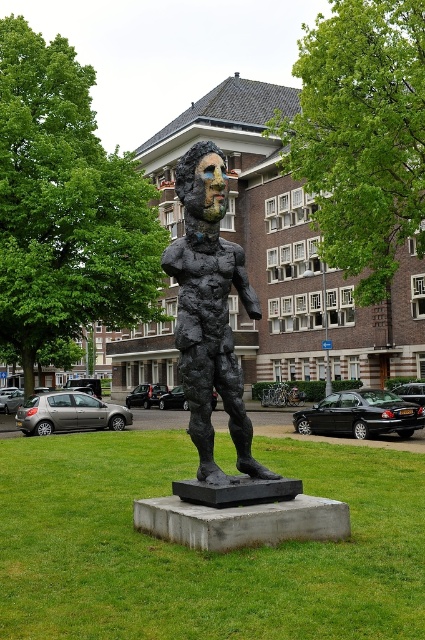
Question: Which point appears farthest from the camera in this image?

Choices:
 (A) (201, 298)
 (B) (331, 465)

Answer: (B)

Question: Which point is closer to the camera?

Choices:
 (A) bronze textured figure at center
 (B) black stone statue at center

Answer: (B)

Question: Is black stone statue at center above bronze textured figure at center?

Choices:
 (A) no
 (B) yes

Answer: (A)

Question: Which object is farther from the camera taking this photo?

Choices:
 (A) bronze textured figure at center
 (B) black stone statue at center

Answer: (A)

Question: Can you confirm if black stone statue at center is smaller than bronze textured figure at center?

Choices:
 (A) no
 (B) yes

Answer: (B)

Question: Does black stone statue at center appear on the right side of bronze textured figure at center?

Choices:
 (A) no
 (B) yes

Answer: (A)